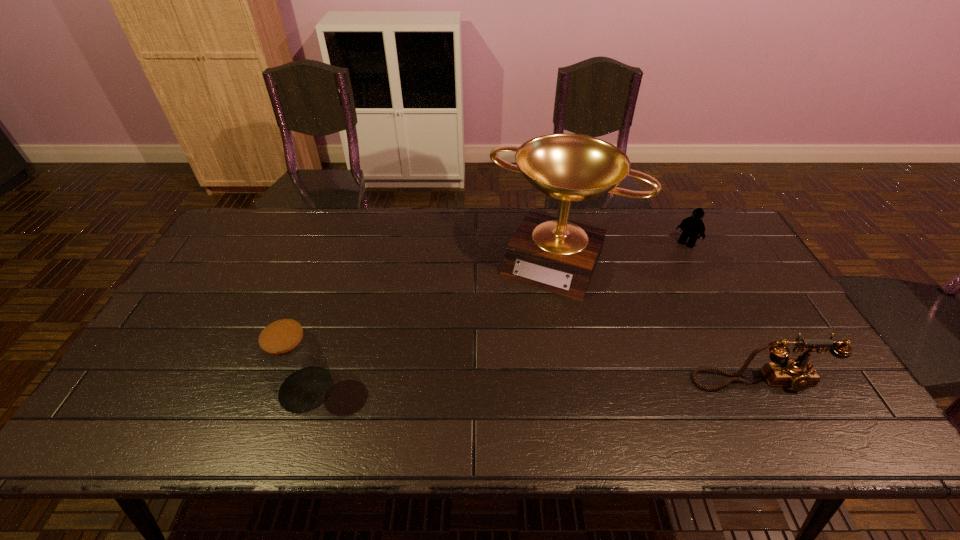
The width and height of the screenshot is (960, 540). What are the coordinates of `object present at the near right corner` in the screenshot? It's located at (798, 373).

This screenshot has height=540, width=960. In order to click on free region at the far edge in this screenshot , I will do `click(328, 211)`.

In the image, there is a desktop. In order to click on vacant space at the near edge in this screenshot , I will do `click(719, 390)`.

Where is `blank space at the right edge`? This screenshot has height=540, width=960. blank space at the right edge is located at coordinates (723, 294).

Identify the location of vacant region at the far right corner. (698, 238).

Identify the location of blank region between the second tallest object and the award. (433, 325).

Find the location of a particular element. free spot between the Lego and the award is located at coordinates (622, 252).

Find the location of a particular element. vacant point located between the telephone and the award is located at coordinates (659, 321).

The image size is (960, 540). I want to click on free point between the leftmost object and the telephone, so click(533, 385).

At what (x,y) coordinates should I click in order to perform the action: click on unoccupied position between the award and the telephone. Please return your answer as a coordinate pair (x, y). The image size is (960, 540). Looking at the image, I should click on (659, 321).